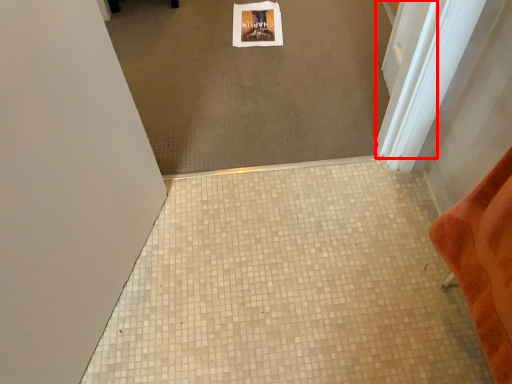
Question: Considering the relative positions of screen door (annotated by the red box) and tile in the image provided, where is screen door (annotated by the red box) located with respect to the staircase?

Choices:
 (A) left
 (B) right

Answer: (B)